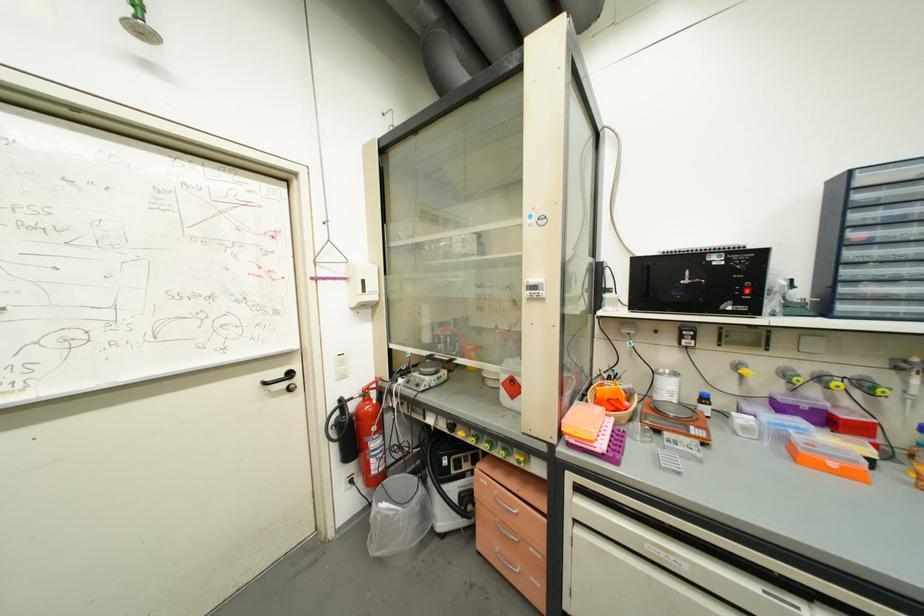
At what (x,y) coordinates should I click in order to perform the action: click on purple lidded box. Please return your answer as a coordinate pair (x, y). The height and width of the screenshot is (616, 924). Looking at the image, I should click on (799, 407).